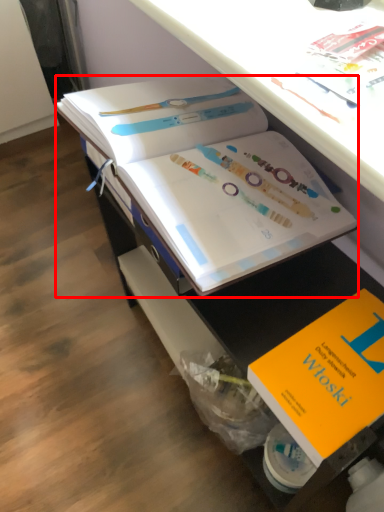
Question: Where is book (annotated by the red box) located in relation to book in the image?

Choices:
 (A) left
 (B) right

Answer: (A)